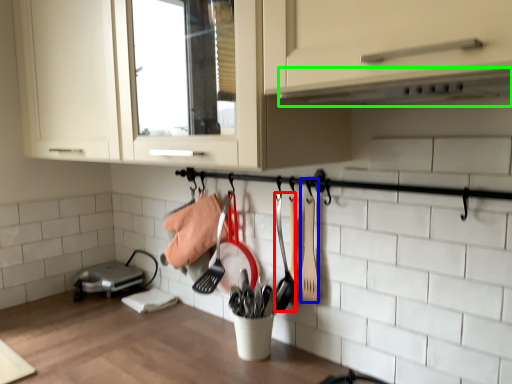
Question: Based on their relative distances, which object is farther from shovel (highlighted by a red box)? Choose from spatula (highlighted by a blue box) and exhaust hood (highlighted by a green box).

Choices:
 (A) spatula
 (B) exhaust hood

Answer: (B)